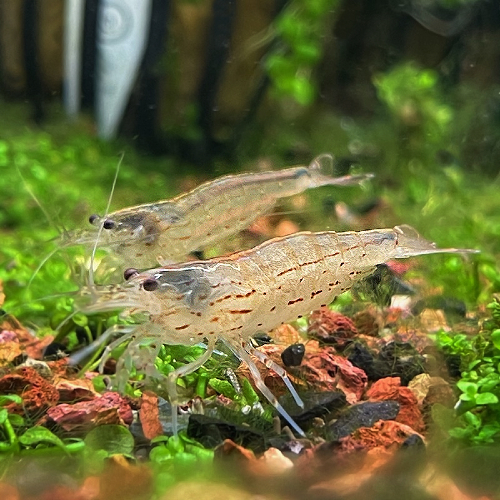
Locate an element on the screen. fish tank is located at coordinates (243, 132).